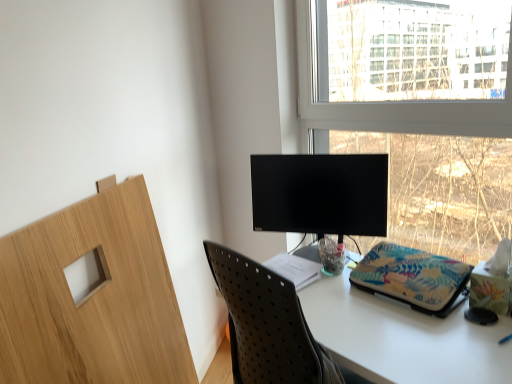
Question: Can white paper at center be found inside floral fabric laptop sleeve at center?

Choices:
 (A) yes
 (B) no

Answer: (B)

Question: Is floral fabric laptop sleeve at center taller than white paper at center?

Choices:
 (A) yes
 (B) no

Answer: (A)

Question: Does floral fabric laptop sleeve at center appear on the left side of white paper at center?

Choices:
 (A) yes
 (B) no

Answer: (B)

Question: From a real-world perspective, is floral fabric laptop sleeve at center on white paper at center?

Choices:
 (A) no
 (B) yes

Answer: (B)

Question: Is floral fabric laptop sleeve at center further to the viewer compared to white paper at center?

Choices:
 (A) no
 (B) yes

Answer: (A)

Question: From the image's perspective, is floral fabric laptop sleeve at center positioned above or below transparent glass window at upper right?

Choices:
 (A) below
 (B) above

Answer: (A)

Question: Does point (396, 294) appear closer or farther from the camera than point (394, 122)?

Choices:
 (A) farther
 (B) closer

Answer: (B)

Question: From a real-world perspective, is floral fabric laptop sleeve at center physically located above or below transparent glass window at upper right?

Choices:
 (A) above
 (B) below

Answer: (B)

Question: Would you say floral fabric laptop sleeve at center is inside or outside transparent glass window at upper right?

Choices:
 (A) inside
 (B) outside

Answer: (B)

Question: Considering their positions, is transparent glass window at upper right located in front of or behind white paper at center?

Choices:
 (A) behind
 (B) front

Answer: (B)

Question: Considering the positions of transparent glass window at upper right and white paper at center in the image, is transparent glass window at upper right wider or thinner than white paper at center?

Choices:
 (A) wide
 (B) thin

Answer: (B)

Question: From a real-world perspective, relative to white paper at center, is transparent glass window at upper right vertically above or below?

Choices:
 (A) above
 (B) below

Answer: (A)

Question: Would you say transparent glass window at upper right is inside or outside white paper at center?

Choices:
 (A) inside
 (B) outside

Answer: (B)

Question: In the image, is floral fabric laptop sleeve at center positioned in front of or behind white paper at center?

Choices:
 (A) front
 (B) behind

Answer: (A)

Question: Considering the positions of point (373, 251) and point (320, 271), is point (373, 251) closer or farther from the camera than point (320, 271)?

Choices:
 (A) closer
 (B) farther

Answer: (A)